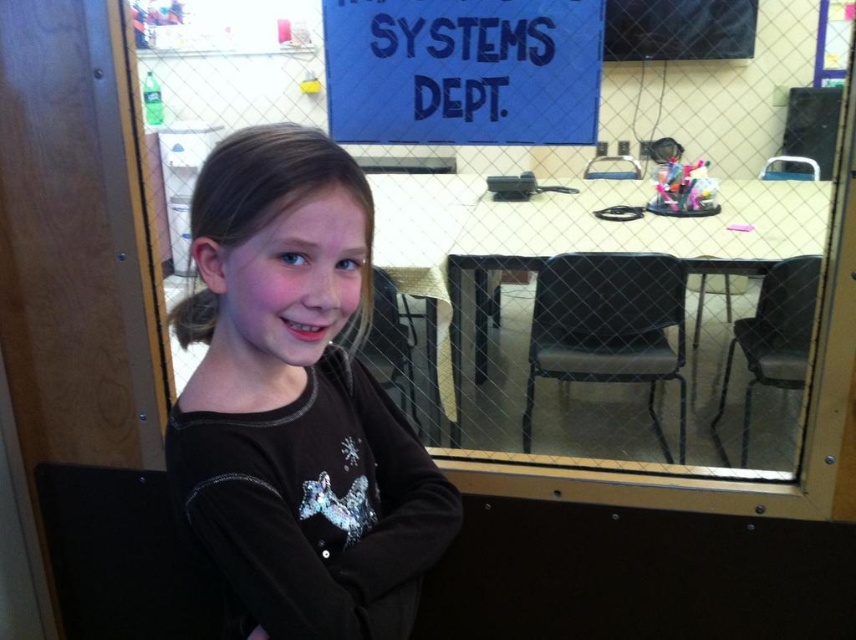
Question: Is dark brown fleece at center closer to the viewer compared to blue fabric sign at upper center?

Choices:
 (A) yes
 (B) no

Answer: (A)

Question: Is dark brown fleece at center bigger than blue fabric sign at upper center?

Choices:
 (A) yes
 (B) no

Answer: (A)

Question: Does dark brown fleece at center have a smaller size compared to blue fabric sign at upper center?

Choices:
 (A) yes
 (B) no

Answer: (B)

Question: Which object appears farthest from the camera in this image?

Choices:
 (A) dark brown fleece at center
 (B) blue fabric sign at upper center

Answer: (B)